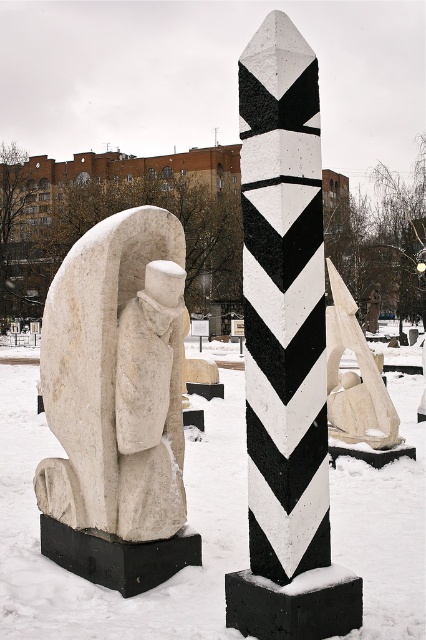
Question: Is black and white painted concrete pillar at center thinner than white stone sculpture at center?

Choices:
 (A) no
 (B) yes

Answer: (B)

Question: Is black and white painted concrete pillar at center smaller than white stone sculpture at center?

Choices:
 (A) no
 (B) yes

Answer: (A)

Question: Estimate the real-world distances between objects in this image. Which object is closer to the black and white painted concrete pillar at center?

Choices:
 (A) white stone sculpture at center
 (B) white stone statue at left

Answer: (B)

Question: Which object is the farthest from the black and white painted concrete pillar at center?

Choices:
 (A) white stone sculpture at center
 (B) white stone statue at left

Answer: (A)

Question: Which point is farther to the camera?

Choices:
 (A) (118, 243)
 (B) (282, 292)
 (C) (342, 384)

Answer: (C)

Question: Is white stone statue at left closer to the viewer compared to white stone sculpture at center?

Choices:
 (A) no
 (B) yes

Answer: (B)